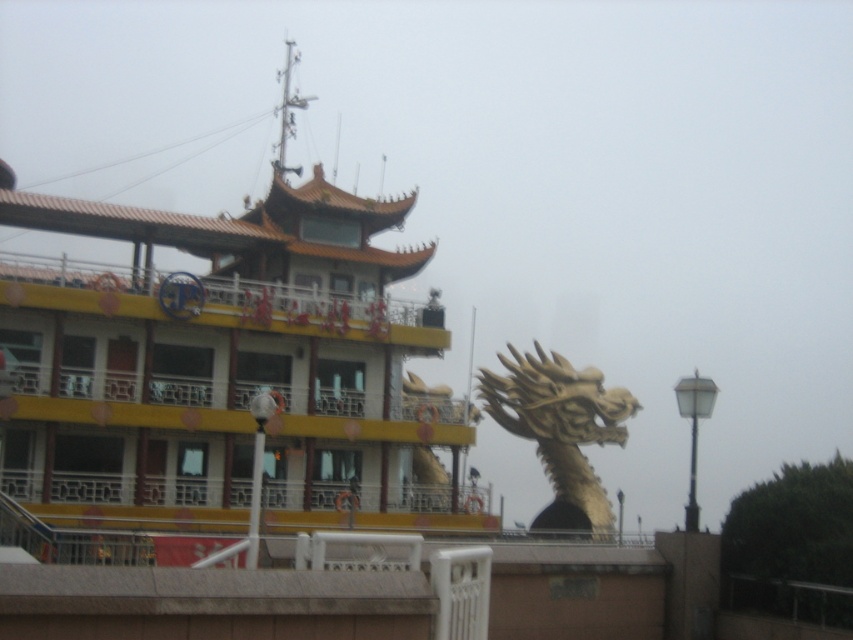
You are a visitor standing in front of the building and notice two decorative elements. The yellow matte boat at upper left and the gold metallic dragon at center. Which one appears larger in size?

The yellow matte boat at upper left is bigger than the gold metallic dragon at center, so the yellow matte boat at upper left appears larger in size.

You are standing at the entrance of the building and want to locate the yellow matte boat at upper left. According to the coordinates given, where should you look relative to the building?

The yellow matte boat at upper left is located at coordinates point [225,365], which means it is positioned to the upper left relative to the building.

From the picture: You are a tourist standing in front of the multi story building with traditional Chinese architectural elements. You want to take a photo of the gold metallic dragon at center. Where should you position yourself to capture the dragon in the frame?

The gold metallic dragon at center is located at point (560, 432), so you should position yourself directly in front of the dragon to ensure it is centered in your photo.